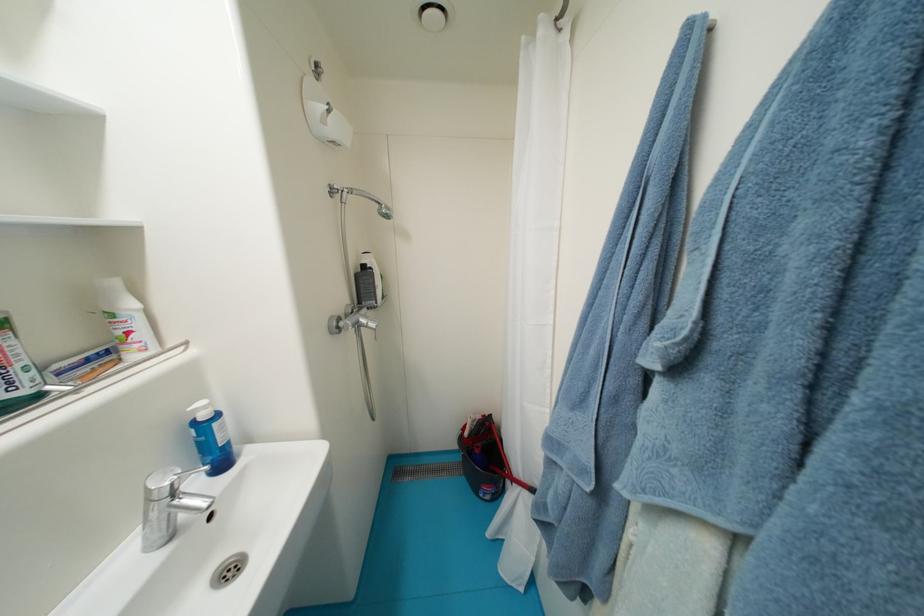
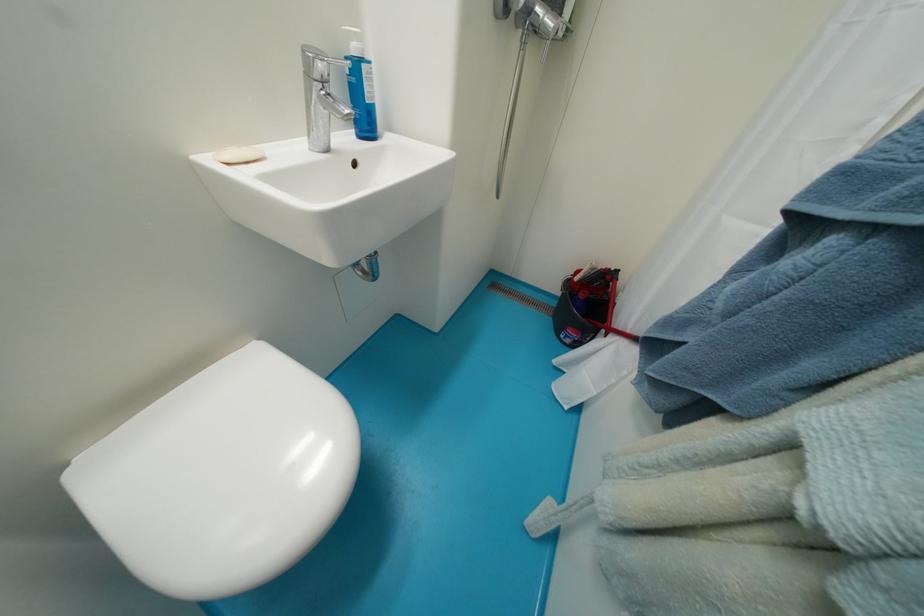
Based on the continuous images, in which direction is the camera rotating?

The camera's rotation is toward left-down.